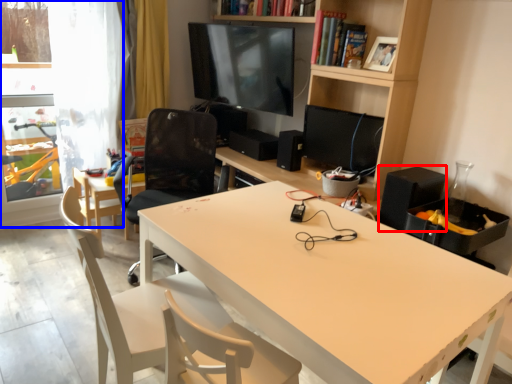
Question: Among these objects, which one is nearest to the camera, speaker (highlighted by a red box) or glass door (highlighted by a blue box)?

Choices:
 (A) speaker
 (B) glass door

Answer: (A)